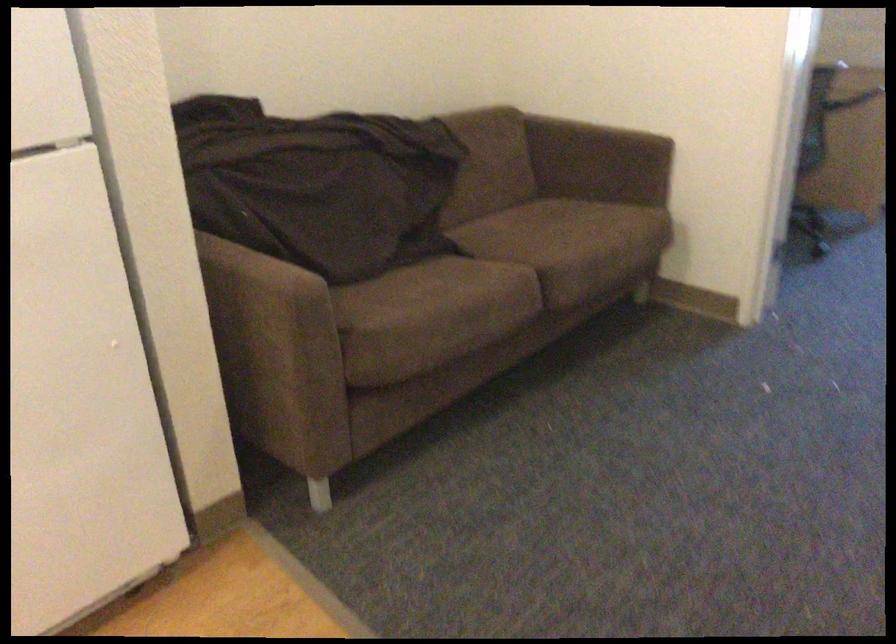
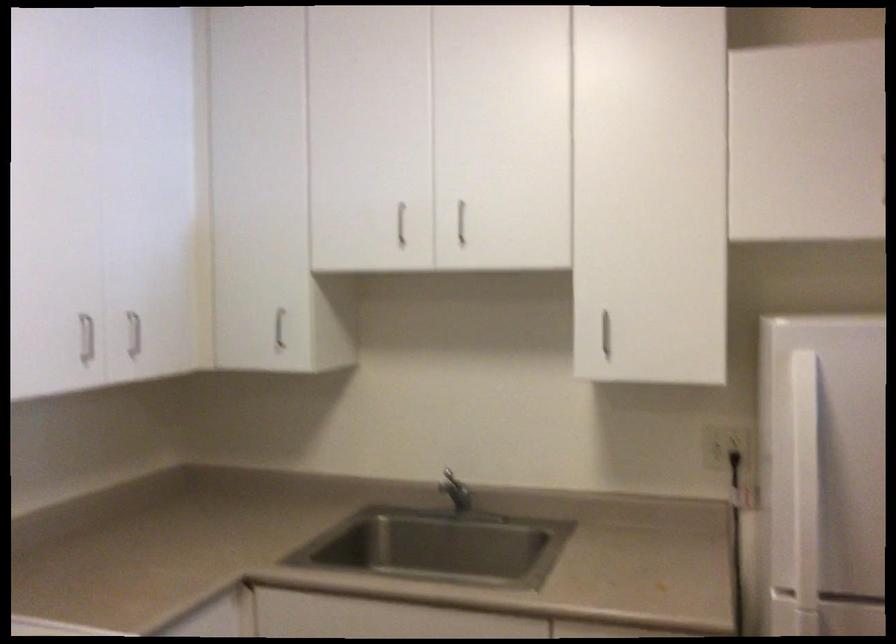
Question: The first image is from the beginning of the video and the second image is from the end. How did the camera likely rotate when shooting the video?

Choices:
 (A) Left
 (B) Right
 (C) Up
 (D) Down

Answer: (A)